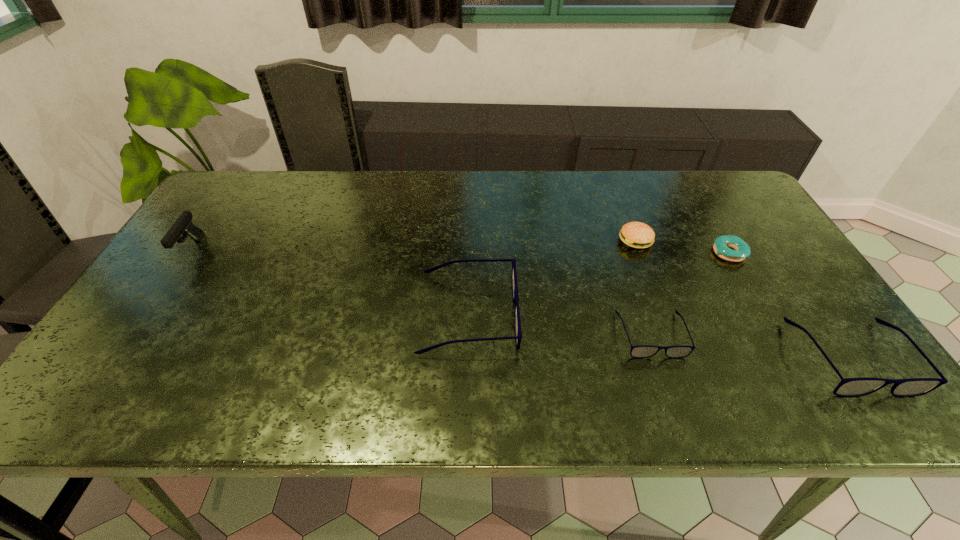
Find the location of a particular element. object that stands as the second closest to the shortest object is located at coordinates (848, 387).

Identify which spectacles is located as the second nearest to the leftmost spectacles. Please provide its 2D coordinates. Your answer should be formatted as a tuple, i.e. [(x, y)], where the tuple contains the x and y coordinates of a point satisfying the conditions above.

[(848, 387)]

You are a GUI agent. You are given a task and a screenshot of the screen. Output one action in this format:
    pyautogui.click(x=<x>, y=<y>)
    Task: Click on the spectacles identified as the third closest to the leftmost object
    
    Given the screenshot: What is the action you would take?
    pyautogui.click(x=848, y=387)

Find the location of `free space that satisfies the following two spatial constraints: 1. on the front side of the patty; 2. on the right side of the doughnut`. free space that satisfies the following two spatial constraints: 1. on the front side of the patty; 2. on the right side of the doughnut is located at coordinates (640, 253).

Locate an element on the screen. This screenshot has width=960, height=540. blank space that satisfies the following two spatial constraints: 1. on the front-facing side of the doughnut; 2. on the left side of the leftmost object is located at coordinates (189, 253).